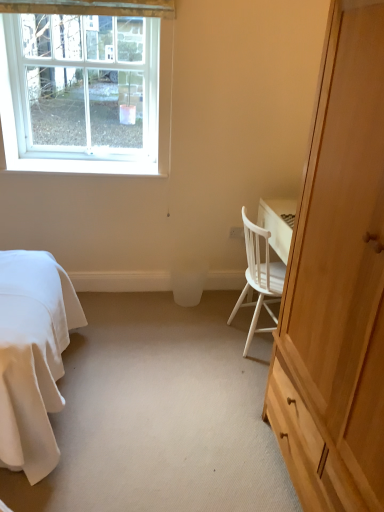
Question: From the image's perspective, would you say white plastic power outlet at center is positioned over white plastic window at upper left?

Choices:
 (A) no
 (B) yes

Answer: (A)

Question: Does white plastic power outlet at center come behind white plastic window at upper left?

Choices:
 (A) no
 (B) yes

Answer: (B)

Question: Considering the relative sizes of white plastic power outlet at center and white plastic window at upper left in the image provided, is white plastic power outlet at center shorter than white plastic window at upper left?

Choices:
 (A) no
 (B) yes

Answer: (B)

Question: Is white plastic power outlet at center looking in the opposite direction of white plastic window at upper left?

Choices:
 (A) yes
 (B) no

Answer: (B)

Question: Can you confirm if white plastic power outlet at center is taller than white plastic window at upper left?

Choices:
 (A) yes
 (B) no

Answer: (B)

Question: Can you confirm if white plastic power outlet at center is thinner than white plastic window at upper left?

Choices:
 (A) no
 (B) yes

Answer: (B)

Question: From a real-world perspective, is white wood chair at right on light wood cabinet at right?

Choices:
 (A) no
 (B) yes

Answer: (A)

Question: From the image's perspective, does white wood chair at right appear higher than light wood cabinet at right?

Choices:
 (A) no
 (B) yes

Answer: (B)

Question: Does white wood chair at right have a greater width compared to light wood cabinet at right?

Choices:
 (A) no
 (B) yes

Answer: (A)

Question: Does white wood chair at right have a lesser width compared to light wood cabinet at right?

Choices:
 (A) no
 (B) yes

Answer: (B)

Question: Can you confirm if white wood chair at right is positioned to the right of light wood cabinet at right?

Choices:
 (A) no
 (B) yes

Answer: (A)

Question: Is white wood chair at right positioned behind light wood cabinet at right?

Choices:
 (A) no
 (B) yes

Answer: (B)

Question: From a real-world perspective, is white plastic power outlet at center located higher than white wood chair at right?

Choices:
 (A) yes
 (B) no

Answer: (A)